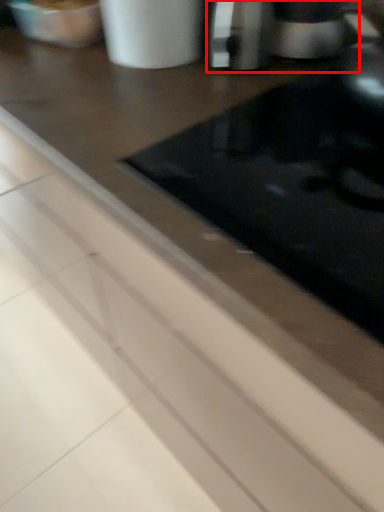
Question: From the image's perspective, what is the correct spatial relationship of coffee machine (annotated by the red box) in relation to appliance?

Choices:
 (A) below
 (B) above

Answer: (A)